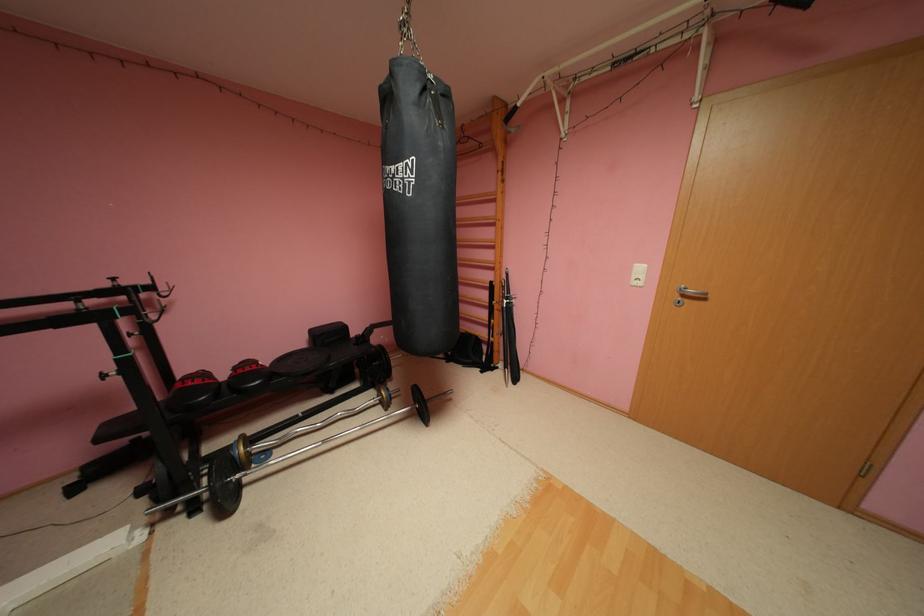
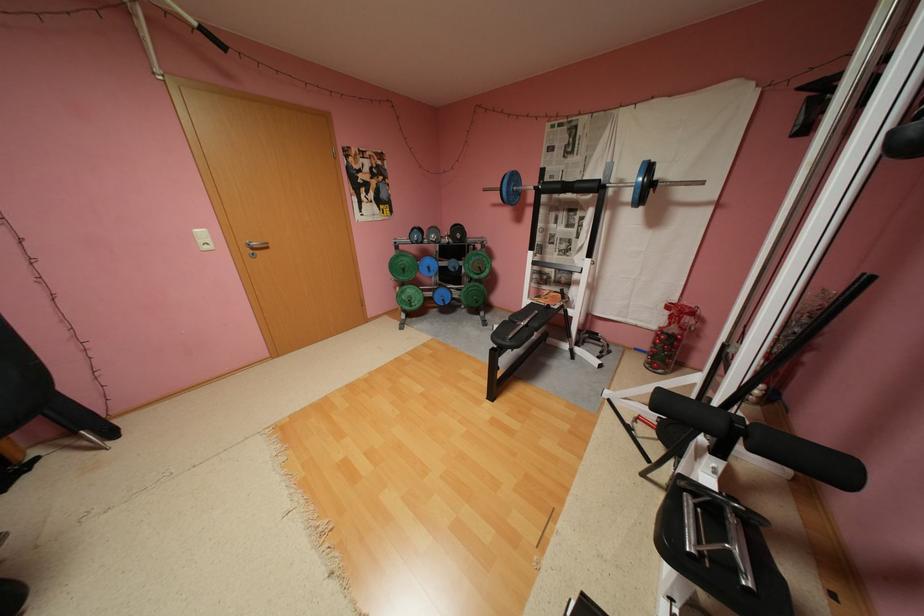
Question: I am providing you with two images of the same scene from different viewpoints. After the viewpoint changes to image2, which objects are now occluded?

Choices:
 (A) barbell bar
 (B) black pull-up grip
 (C) blue barbell weight
 (D) none of these

Answer: (D)